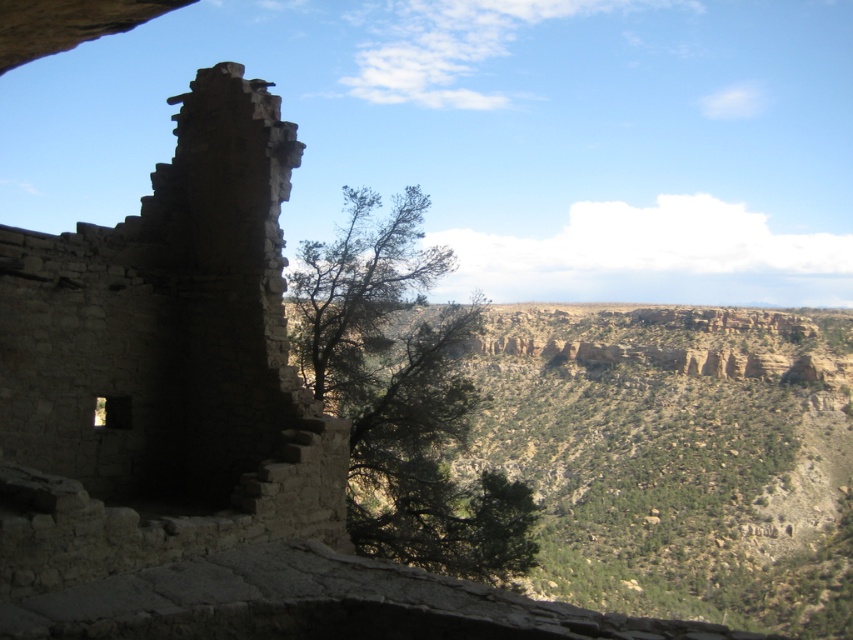
Measure the distance between rustic stone ruins at left and camera.

rustic stone ruins at left is 25.83 meters away from camera.

Can you confirm if rustic stone ruins at left is positioned below green leafy tree at center?

Correct, rustic stone ruins at left is located below green leafy tree at center.

Measure the distance between rustic stone ruins at left and camera.

rustic stone ruins at left and camera are 84.73 feet apart from each other.

Locate an element on the screen. rustic stone ruins at left is located at coordinates (161, 365).